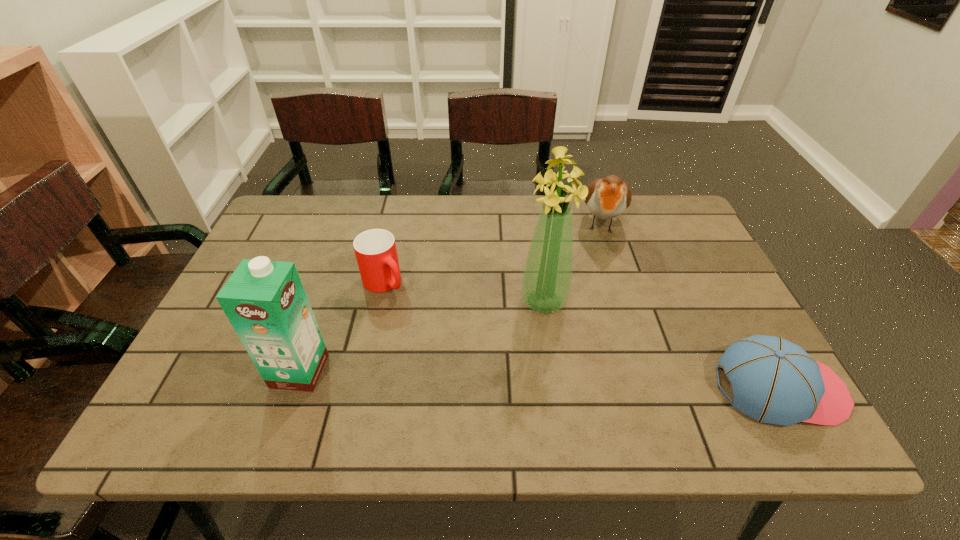
This screenshot has width=960, height=540. I want to click on vacant spot on the desktop that is between the fourth shortest object and the baseball cap and is positioned at the face of the fourth object from left to right, so click(x=592, y=381).

The width and height of the screenshot is (960, 540). Identify the location of vacant space on the desktop that is between the leftmost object and the baseball cap and is positioned on the front-facing side of the tallest object. (571, 380).

Locate an element on the screen. This screenshot has width=960, height=540. free spot on the desktop that is between the fourth shortest object and the baseball cap and is positioned on the side of the cup with the handle is located at coordinates (488, 377).